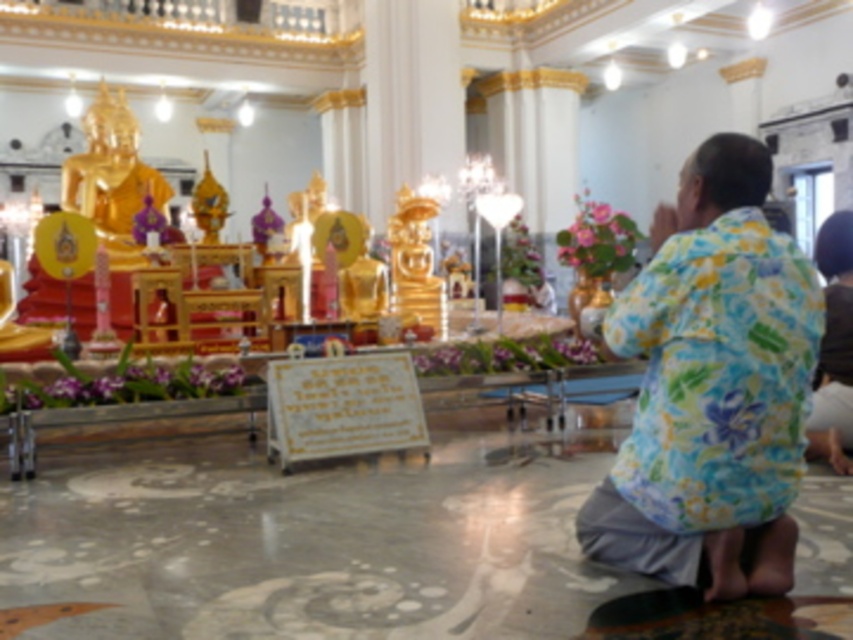
Between point (637, 429) and point (846, 372), which one is positioned in front?

Point (637, 429) is in front.

Image resolution: width=853 pixels, height=640 pixels. I want to click on floral fabric shirt at center, so click(712, 387).